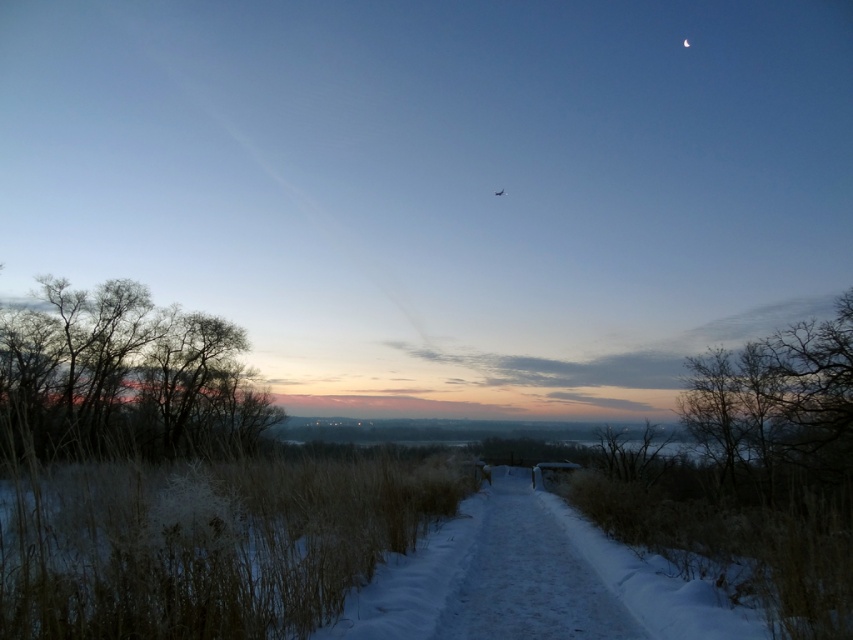
Question: Which of the following is the closest to the observer?

Choices:
 (A) white snow trail at center
 (B) bare branches at left

Answer: (B)

Question: Which point is farther to the camera?

Choices:
 (A) white snow trail at center
 (B) bare branches at left

Answer: (A)

Question: Does bare branches at left have a lesser width compared to white snow trail at center?

Choices:
 (A) yes
 (B) no

Answer: (B)

Question: Does bare branches at left have a lesser width compared to white snow trail at center?

Choices:
 (A) no
 (B) yes

Answer: (A)

Question: Can you confirm if bare branches at left is positioned to the left of white snow trail at center?

Choices:
 (A) no
 (B) yes

Answer: (B)

Question: Which point is farther to the camera?

Choices:
 (A) (177, 316)
 (B) (547, 536)

Answer: (A)